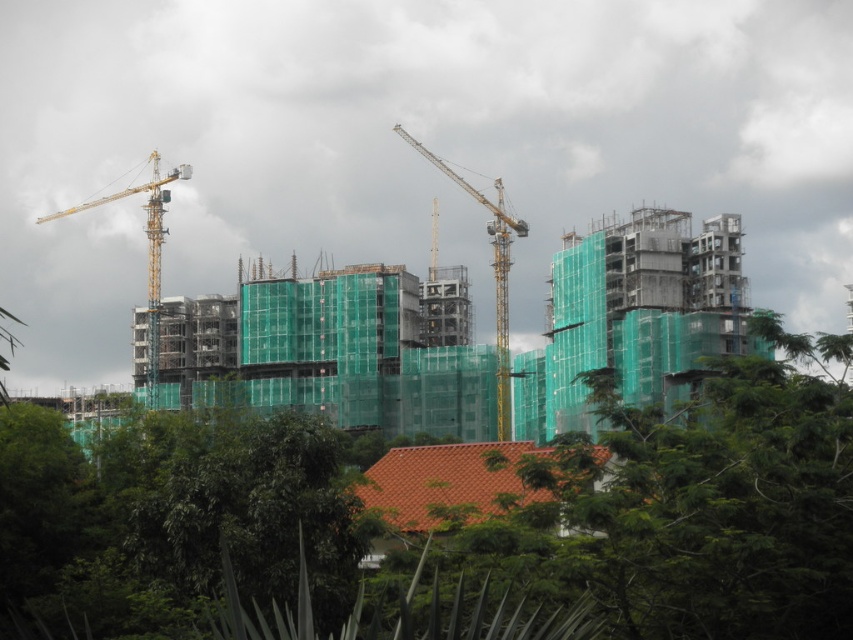
Question: Does green leafy tree at center appear under yellow metallic crane at center?

Choices:
 (A) no
 (B) yes

Answer: (B)

Question: Which object is closer to the camera taking this photo?

Choices:
 (A) yellow metallic crane at left
 (B) green leafy tree at center

Answer: (B)

Question: Can you confirm if yellow metallic crane at center is positioned to the right of yellow metallic crane at left?

Choices:
 (A) no
 (B) yes

Answer: (B)

Question: Is yellow metallic crane at center bigger than yellow metallic crane at left?

Choices:
 (A) yes
 (B) no

Answer: (B)

Question: Which of the following is the closest to the observer?

Choices:
 (A) (160, 256)
 (B) (509, 250)

Answer: (B)

Question: Which object appears closest to the camera in this image?

Choices:
 (A) yellow metallic crane at left
 (B) green leafy tree at center

Answer: (B)